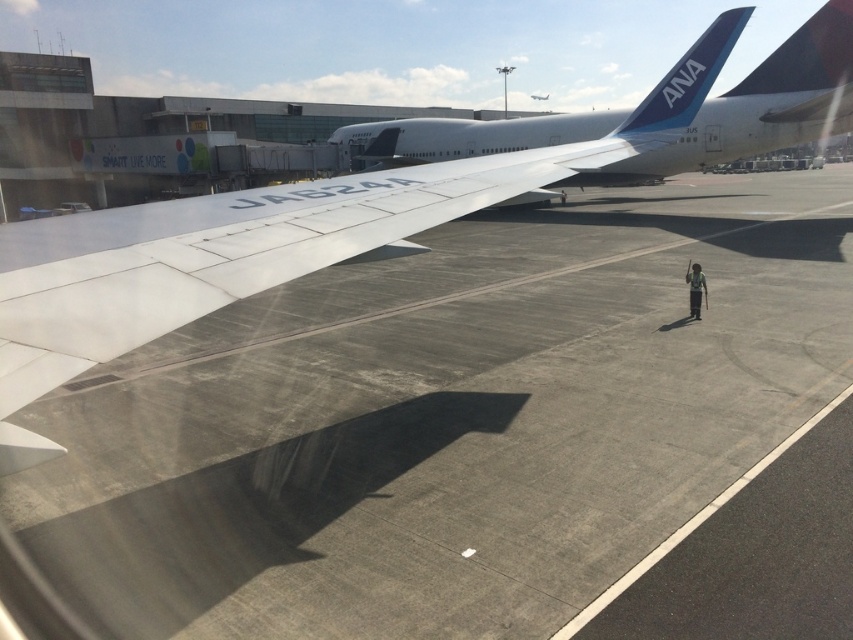
You are standing on the airport tarmac and see the white matte wing at center. What are the coordinates of its position?

The white matte wing at center is located at coordinates point (219,259).

You are standing at the airport tarmac and see two points marked on the airplane wing. The first point is at coordinate point (695, 493) and the second is at point (704, 298). Which point appears closer to you?

Point (695, 493) is closer to the camera than point (704, 298), so the first point appears closer to you.

You are standing at the point marked as point [439,493] on the airport tarmac. You want to take a photo of the airplane wing with the registration number JA824A. Is the camera positioned close enough to capture the entire wing in the photo?

The distance between point [439,493] and the camera is 4.43 meters. Whether the camera can capture the entire wing depends on the lens and sensor size of the camera. Since the question does not provide information about the camera equipment, it is impossible to determine if the entire wing can be captured from this distance.